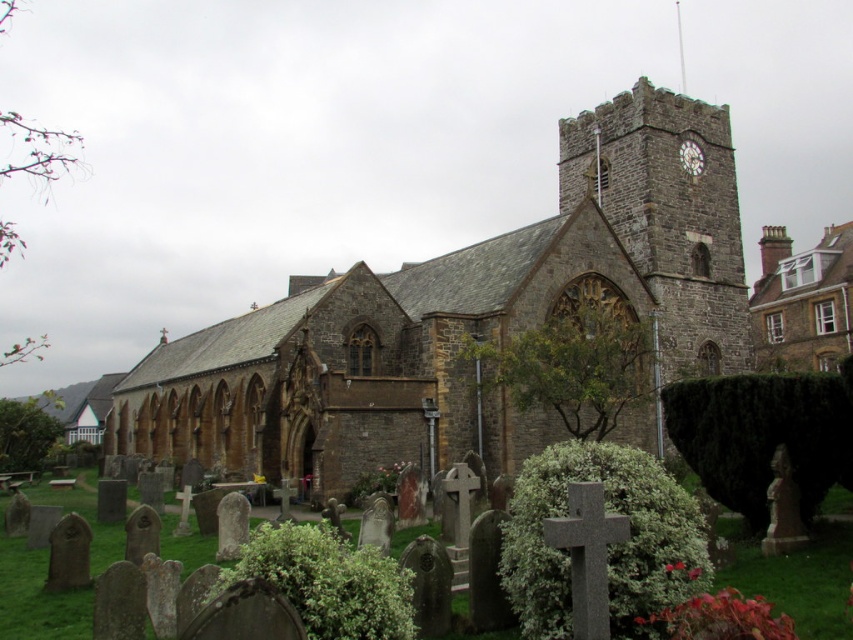
Question: Can you confirm if brown stone church at upper right is positioned below matte brown clock at upper right?

Choices:
 (A) yes
 (B) no

Answer: (A)

Question: Which of these objects is positioned closest to the brown stone church at center?

Choices:
 (A) brown stone church at upper right
 (B) matte brown clock at upper right

Answer: (B)

Question: Is brown stone church at center positioned before brown stone church at upper right?

Choices:
 (A) no
 (B) yes

Answer: (B)

Question: Can you confirm if brown stone church at center is positioned to the left of brown stone church at upper right?

Choices:
 (A) no
 (B) yes

Answer: (B)

Question: Among these objects, which one is farthest from the camera?

Choices:
 (A) brown stone church at upper right
 (B) matte brown clock at upper right
 (C) brown stone church at center

Answer: (A)

Question: Which point is farther from the camera taking this photo?

Choices:
 (A) (612, 184)
 (B) (787, 269)
 (C) (692, 145)

Answer: (B)